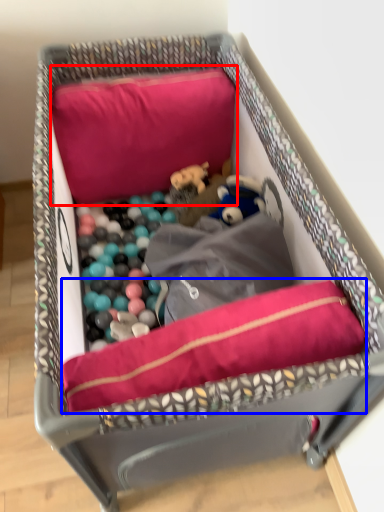
Question: Which object is further to the camera taking this photo, pillow (highlighted by a red box) or dog bed (highlighted by a blue box)?

Choices:
 (A) pillow
 (B) dog bed

Answer: (A)